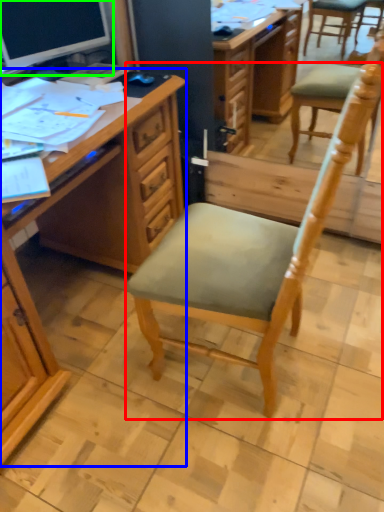
Question: Considering the real-world distances, which object is closest to chair (highlighted by a red box)? desk (highlighted by a blue box) or computer monitor (highlighted by a green box).

Choices:
 (A) desk
 (B) computer monitor

Answer: (A)